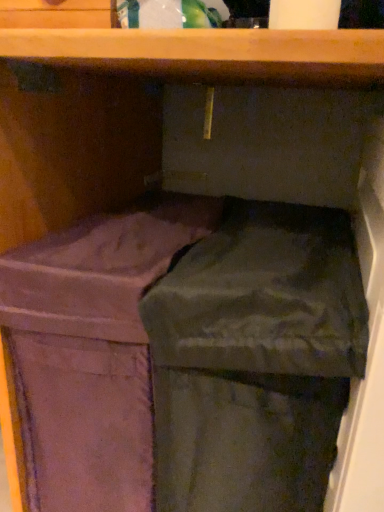
The height and width of the screenshot is (512, 384). Find the location of `dark gray fabric at center`. dark gray fabric at center is located at coordinates (255, 360).

Image resolution: width=384 pixels, height=512 pixels. Describe the element at coordinates (255, 360) in the screenshot. I see `dark gray fabric at center` at that location.

Based on the photo, what is the approximate height of dark gray fabric at center?

dark gray fabric at center is 26.49 inches tall.

Where is `dark gray fabric at center`? The height and width of the screenshot is (512, 384). dark gray fabric at center is located at coordinates (255, 360).